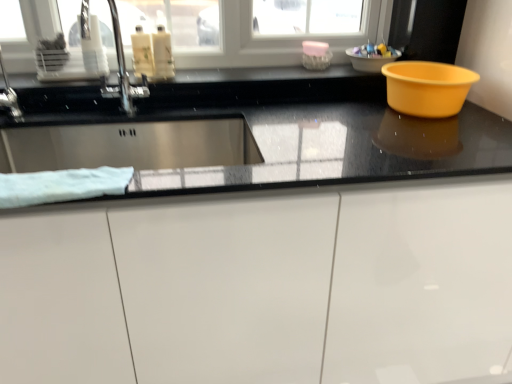
This screenshot has width=512, height=384. I want to click on blank space to the left of translucent plastic bottles at upper center, which is the 1th liquid in right-to-left order, so click(115, 76).